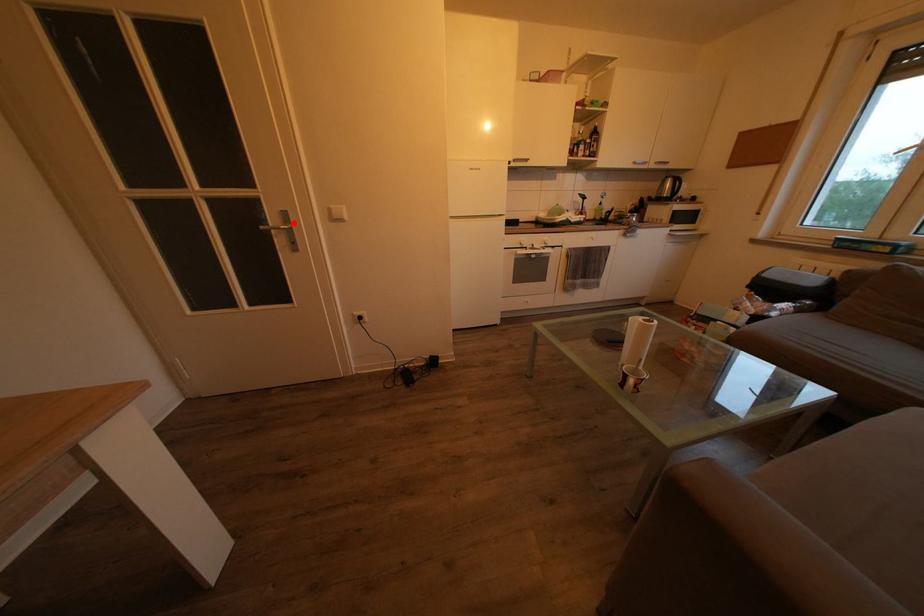
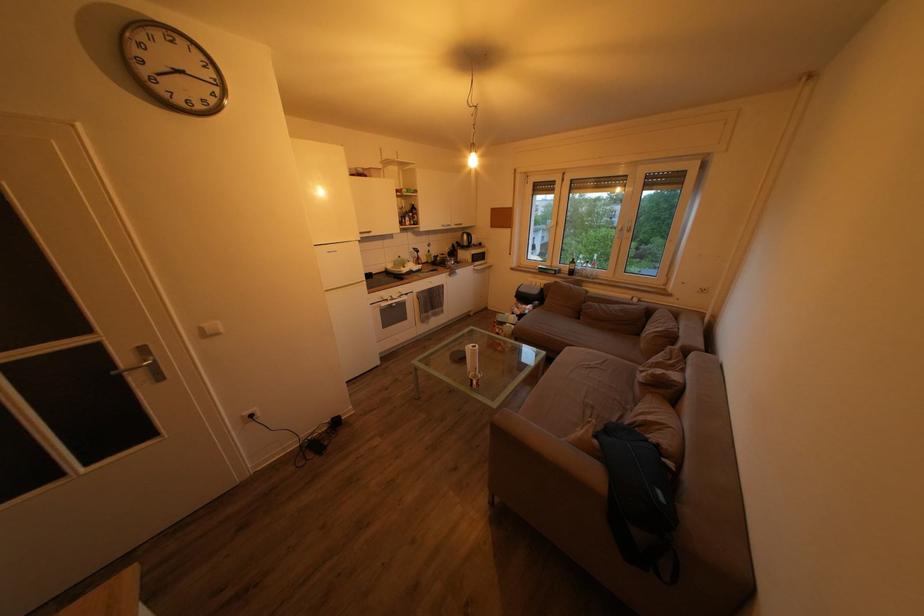
In the second image, find the point that corresponds to the highlighted location in the first image.

(151, 357)